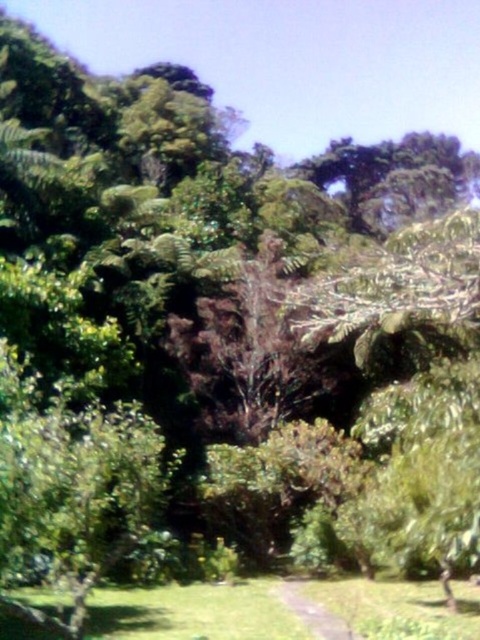
Question: From the image, what is the correct spatial relationship of green grass at lower center in relation to green grassy path at center?

Choices:
 (A) above
 (B) below

Answer: (A)

Question: Is green grass at lower center in front of green grassy path at center?

Choices:
 (A) no
 (B) yes

Answer: (B)

Question: Which object is closer to the camera taking this photo?

Choices:
 (A) green grass at lower center
 (B) green grassy path at center

Answer: (A)

Question: Does green grass at lower center come behind green grassy path at center?

Choices:
 (A) no
 (B) yes

Answer: (A)

Question: Among these points, which one is farthest from the camera?

Choices:
 (A) (177, 616)
 (B) (357, 634)

Answer: (A)

Question: Which point is farther to the camera?

Choices:
 (A) green grassy path at center
 (B) green grass at lower center

Answer: (A)